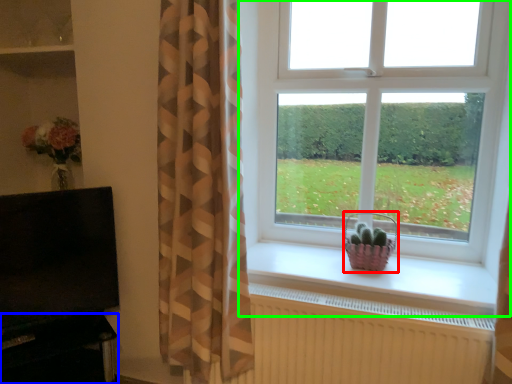
Question: Which object is the closest to the basket (highlighted by a red box)? Choose among these: entertainment center (highlighted by a blue box) or window (highlighted by a green box).

Choices:
 (A) entertainment center
 (B) window

Answer: (B)